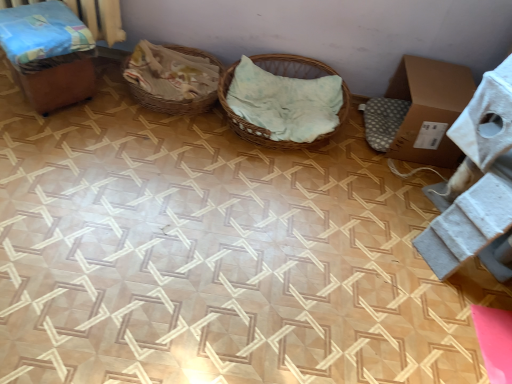
Find the location of a particular element. The height and width of the screenshot is (384, 512). empty space that is in between woven brown basket at center, which ranks as the first basket in left-to-right order, and woven wood basket at center, the second basket viewed from the left is located at coordinates (180, 124).